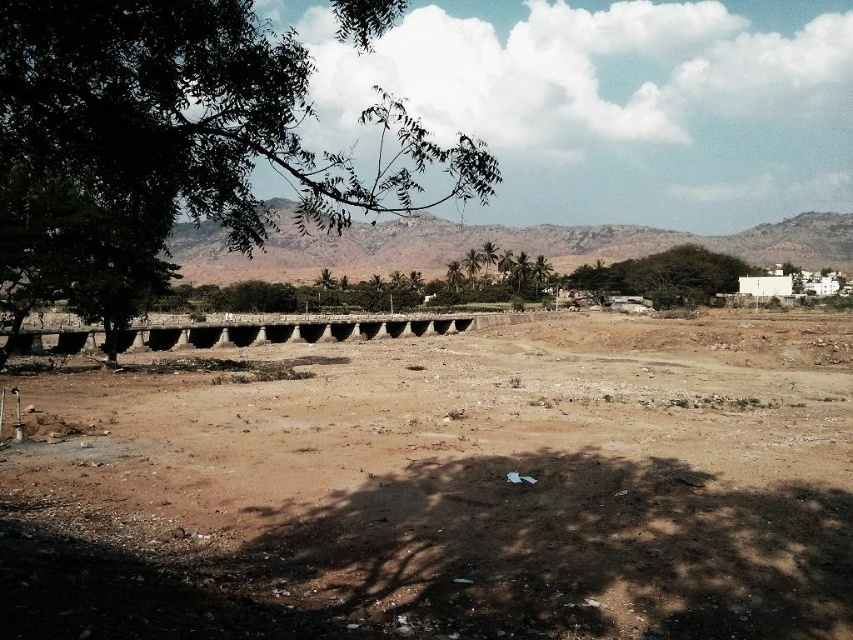
You are standing at the starting point of the stone bridge in the midground. You want to reach the brown sandy dirt field at center. Which direction should you walk to get there?

The brown sandy dirt field at center is located at point (444, 486), so you should walk forward towards the center of the image to reach it.